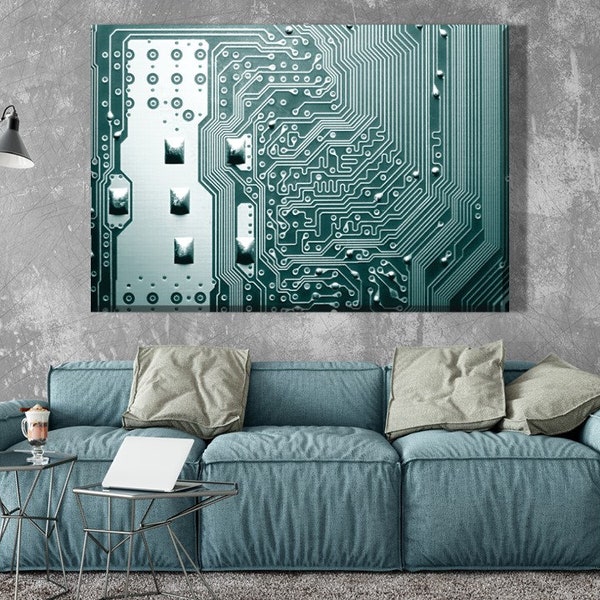
Where is `back cushions`? This screenshot has height=600, width=600. back cushions is located at coordinates (72, 380), (302, 413).